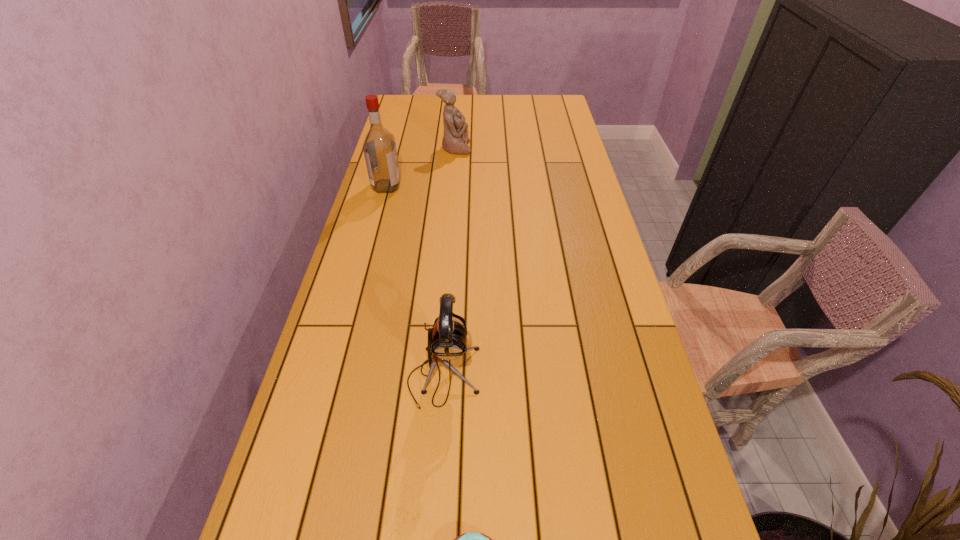
At what (x,y) coordinates should I click in order to perform the action: click on vacant area at the right edge. Please return your answer as a coordinate pair (x, y). Looking at the image, I should click on (555, 164).

The image size is (960, 540). I want to click on free region at the far left corner of the desktop, so click(413, 116).

Where is `free point between the figurine and the earphone`? The width and height of the screenshot is (960, 540). free point between the figurine and the earphone is located at coordinates (449, 262).

Locate an element on the screen. empty location between the farthest object and the third nearest object is located at coordinates (420, 167).

Identify the location of blank region between the earphone and the second farthest object. (415, 281).

Select which object appears as the third closest to the shortest object. Please provide its 2D coordinates. Your answer should be formatted as a tuple, i.e. [(x, y)], where the tuple contains the x and y coordinates of a point satisfying the conditions above.

[(455, 137)]

The height and width of the screenshot is (540, 960). Find the location of `object that is the third closest to the shortest object`. object that is the third closest to the shortest object is located at coordinates (455, 137).

At what (x,y) coordinates should I click in order to perform the action: click on free point that satisfies the following two spatial constraints: 1. on the back side of the earphone; 2. on the front-facing side of the second farthest object. Please return your answer as a coordinate pair (x, y). Looking at the image, I should click on (457, 186).

Image resolution: width=960 pixels, height=540 pixels. I want to click on vacant space that satisfies the following two spatial constraints: 1. on the front-facing side of the second nearest object; 2. on the right side of the farthest object, so click(x=438, y=376).